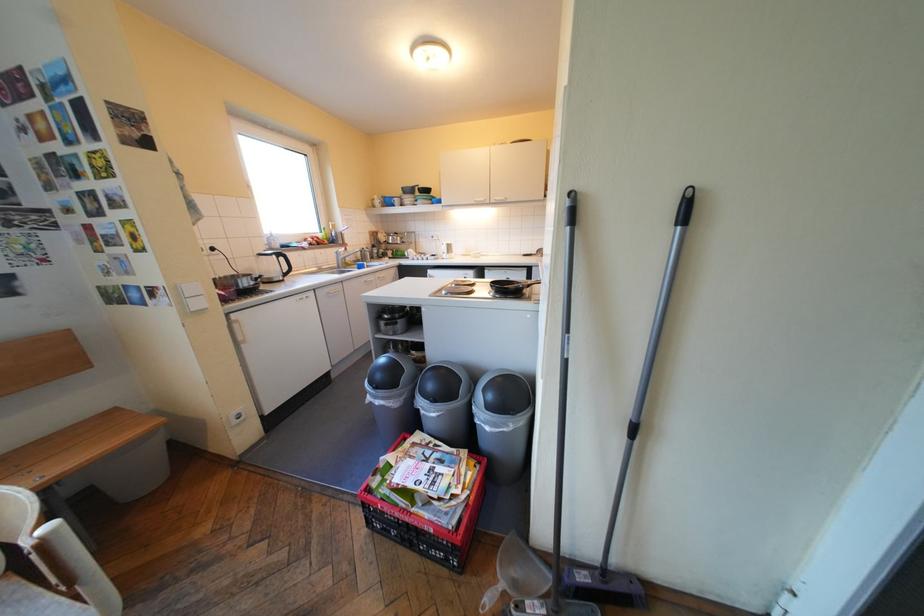
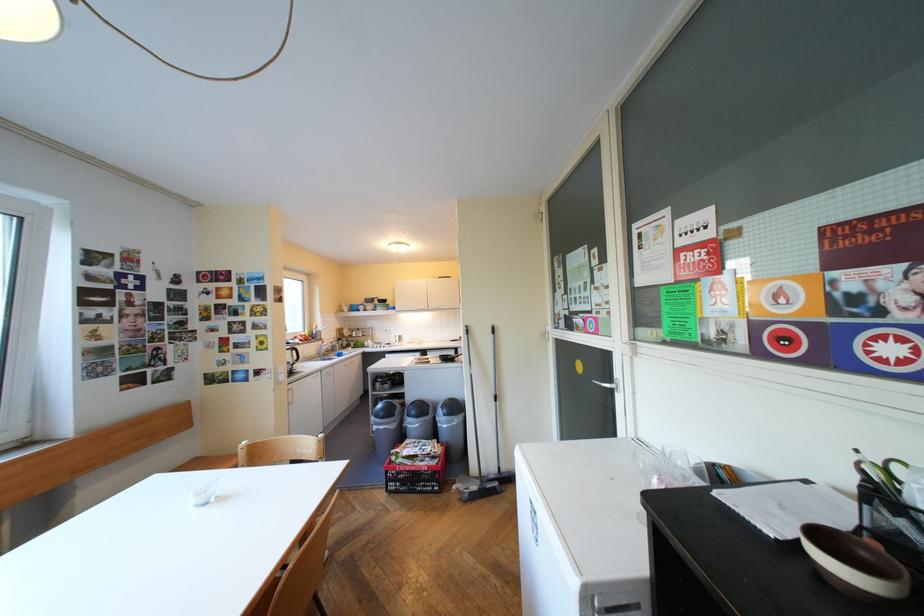
Find the pixel in the second image that matches (x=526, y=424) in the first image.

(469, 419)